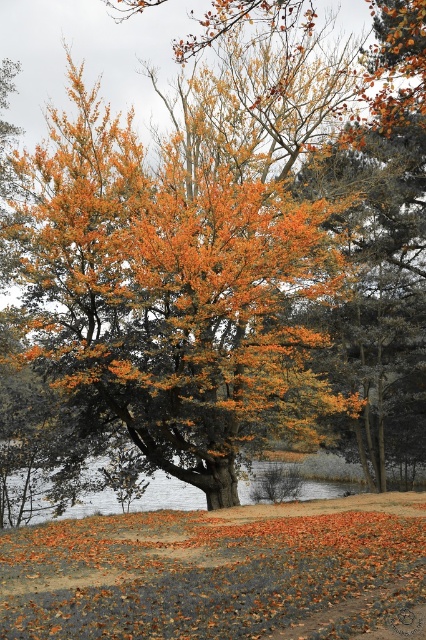
You are standing at the base of the tree and want to walk towards the point that is closer to you. Which point should you walk towards, point [192,566] or point [138,497]?

Point [192,566] is in front of point [138,497], so you should walk towards point [192,566] as it is closer to you.

You are standing at the edge of the smooth gray water at lower center and want to take a photo of the orange leafy tree at center. Will the tree be fully visible in the photo if you stand there?

The orange leafy tree at center is much taller than the smooth gray water at lower center, so if you stand at the edge of the smooth gray water at lower center, the tree will be fully visible in the photo because its height surpasses the water level.